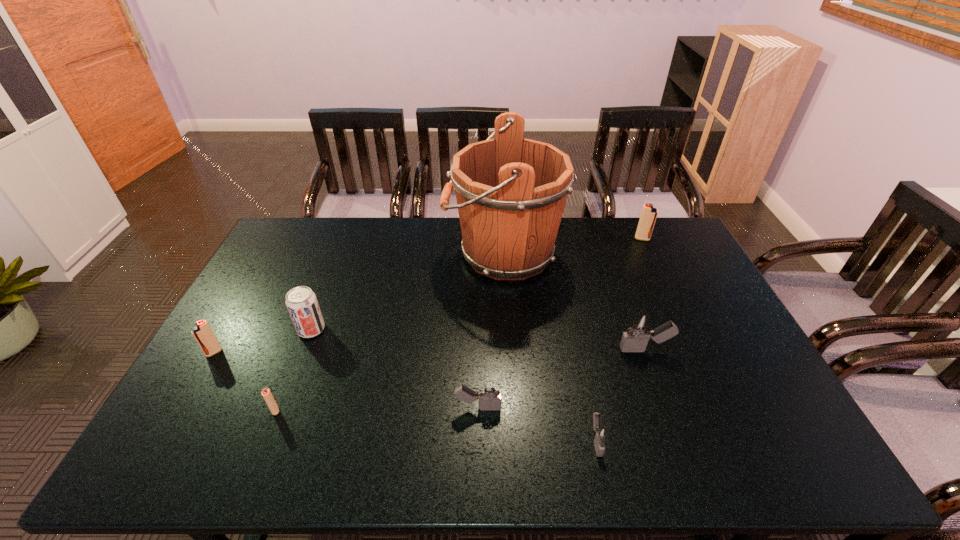
In the image, there is a desktop. At what (x,y) coordinates should I click in order to perform the action: click on vacant space at the far edge. Please return your answer as a coordinate pair (x, y). The image size is (960, 540). Looking at the image, I should click on (x=564, y=226).

What are the coordinates of `vacant point at the left edge` in the screenshot? It's located at (204, 368).

You are a GUI agent. You are given a task and a screenshot of the screen. Output one action in this format:
    pyautogui.click(x=<x>, y=<y>)
    Task: Click on the vacant space at the right edge of the desktop
    This screenshot has height=540, width=960.
    Given the screenshot: What is the action you would take?
    pyautogui.click(x=684, y=278)

The height and width of the screenshot is (540, 960). Identify the location of vacant space at the far left corner. (326, 219).

This screenshot has height=540, width=960. What are the coordinates of `free space at the near left corner of the desktop` in the screenshot? It's located at (186, 450).

Identify the location of blank space at the far right corner. The width and height of the screenshot is (960, 540). (677, 247).

Find the location of a particular element. The width and height of the screenshot is (960, 540). vacant space that is in between the smallest gray igniter and the farthest gray igniter is located at coordinates (620, 395).

This screenshot has width=960, height=540. I want to click on vacant space that is in between the bucket and the nearest red igniter, so click(389, 332).

Identify the location of vacant area that lies between the farthest gray igniter and the rightmost igniter. The height and width of the screenshot is (540, 960). (643, 294).

The height and width of the screenshot is (540, 960). Find the location of `free space between the nearest gray igniter and the soda can`. free space between the nearest gray igniter and the soda can is located at coordinates (454, 385).